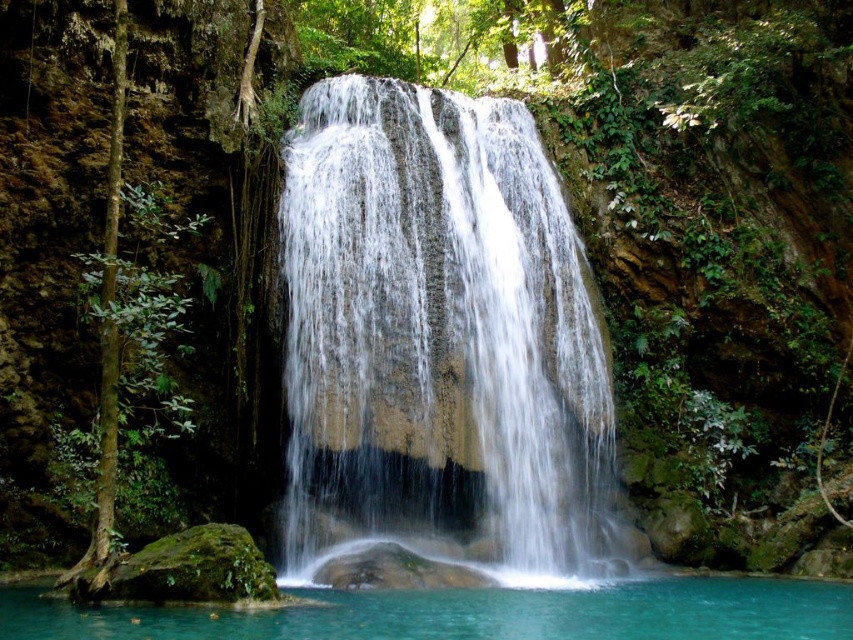
You are standing at the edge of the pool and want to reach the base of the white smooth waterfall at center. Which direction should you move relative to the turquoise water at center?

You should move forward towards the white smooth waterfall at center since the turquoise water at center is behind it.